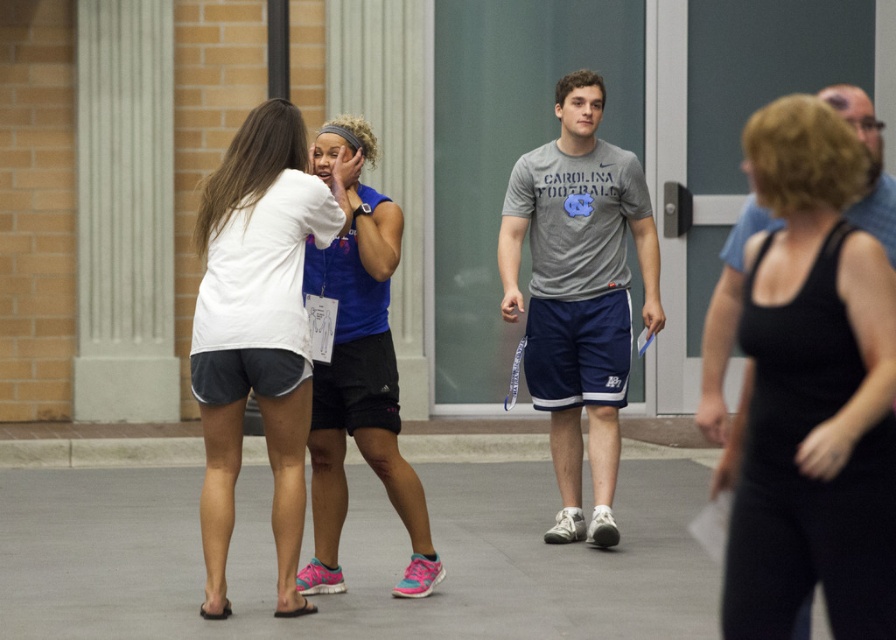
Question: Which object is the closest to the gray cotton t-shirt at center?

Choices:
 (A) white cotton shirt at center
 (B) blue athletic tank top at center
 (C) black tank top at center
 (D) gray concrete pavement at lower center

Answer: (D)

Question: Where is gray concrete pavement at lower center located in relation to blue athletic tank top at center in the image?

Choices:
 (A) right
 (B) left

Answer: (A)

Question: Which point is farther from the camera taking this photo?

Choices:
 (A) (550, 410)
 (B) (248, 493)
 (C) (271, 122)

Answer: (B)

Question: Does white cotton shirt at center appear under blue athletic tank top at center?

Choices:
 (A) no
 (B) yes

Answer: (A)

Question: Based on their relative distances, which object is nearer to the gray concrete pavement at lower center?

Choices:
 (A) gray cotton t-shirt at center
 (B) blue athletic tank top at center

Answer: (B)

Question: Does gray concrete pavement at lower center lie behind white cotton shirt at center?

Choices:
 (A) yes
 (B) no

Answer: (A)